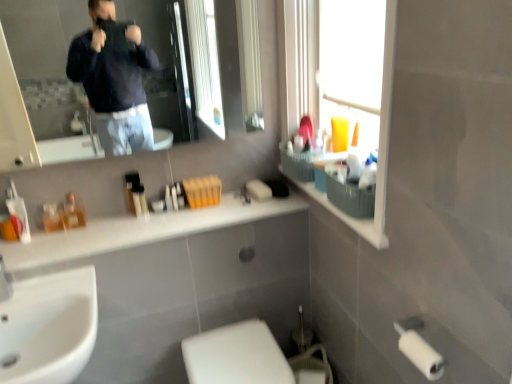
Identify the location of free spot in front of translucent plastic tubes at center, marked as the third toiletry in a left-to-right arrangement. The width and height of the screenshot is (512, 384). (121, 233).